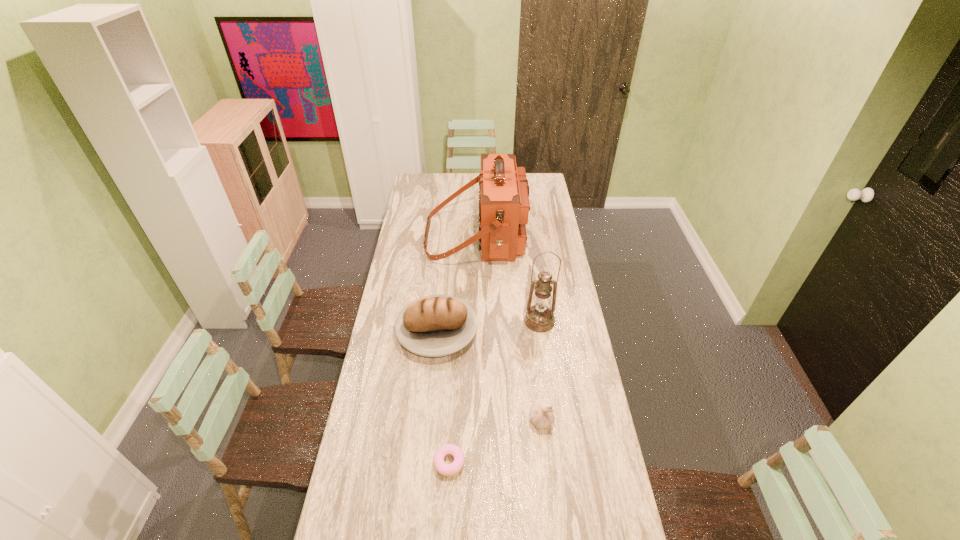
Where is `satchel`? This screenshot has width=960, height=540. satchel is located at coordinates (x=504, y=206).

Find the location of a particular element. This screenshot has width=960, height=540. oil lamp is located at coordinates (539, 318).

Identify the location of bread. This screenshot has width=960, height=540. (438, 325).

Where is `the fourth tallest object`? the fourth tallest object is located at coordinates (541, 417).

Find the location of a particular element. the second nearest object is located at coordinates (541, 417).

The width and height of the screenshot is (960, 540). Find the location of `the nearest object`. the nearest object is located at coordinates (456, 452).

The height and width of the screenshot is (540, 960). What are the coordinates of `the shortest object` in the screenshot? It's located at (456, 452).

Find the location of `free location located on the face side of the farthest object`. free location located on the face side of the farthest object is located at coordinates (x=554, y=236).

The width and height of the screenshot is (960, 540). I want to click on vacant region located on the right of the oil lamp, so click(571, 321).

Locate an element on the screen. vacant space positioned on the front of the third shortest object is located at coordinates (430, 402).